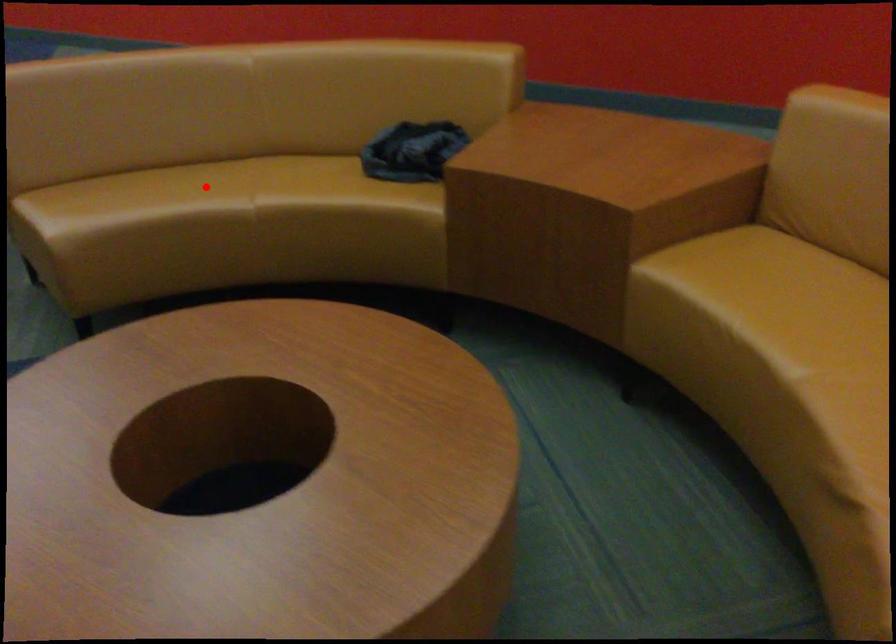
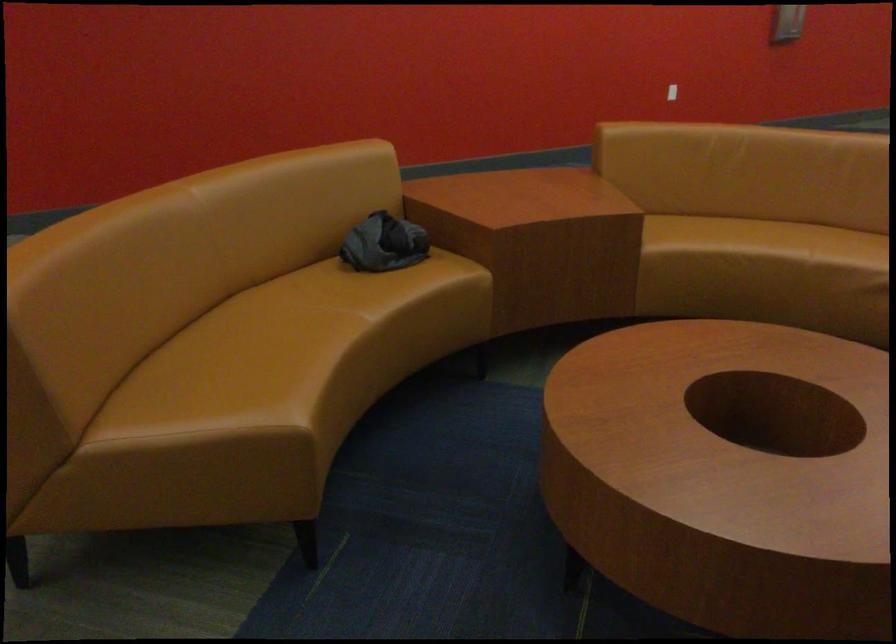
Question: I am providing you with two images of the same scene from different viewpoints. A red point is shown in image1. For the corresponding object point in image2, is it positioned nearer or farther from the camera?

Choices:
 (A) Nearer
 (B) Farther

Answer: (A)